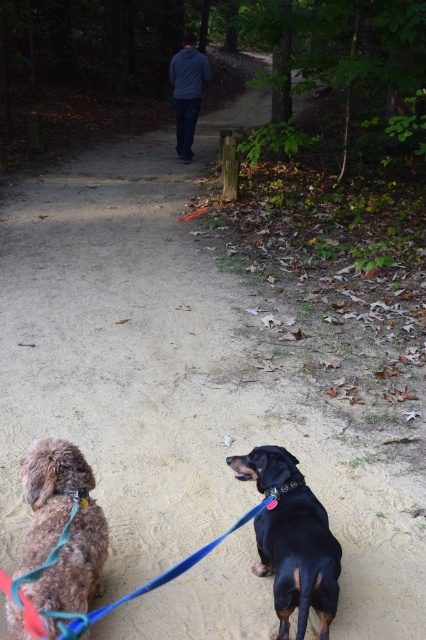
Does blue fabric leash at lower center have a greater height compared to black leather neckband at lower center?

Correct, blue fabric leash at lower center is much taller as black leather neckband at lower center.

Where is `blue fabric leash at lower center`? This screenshot has width=426, height=640. blue fabric leash at lower center is located at coordinates (155, 577).

Is black smooth dog at lower right closer to the viewer compared to blue fabric leash at lower center?

No, it is behind blue fabric leash at lower center.

Is point (273, 518) less distant than point (161, 579)?

No, it is not.

Between point (290, 566) and point (206, 550), which one is positioned behind?

Point (206, 550)

What are the coordinates of `black smooth dog at lower right` in the screenshot? It's located at (299, 561).

Is blue denim jacket at center thinner than matte brown leather collar at lower left?

Incorrect, blue denim jacket at center's width is not less than matte brown leather collar at lower left's.

This screenshot has height=640, width=426. Describe the element at coordinates (187, 92) in the screenshot. I see `blue denim jacket at center` at that location.

Who is more forward, [183,54] or [86,492]?

Point [86,492]

I want to click on blue denim jacket at center, so click(x=187, y=92).